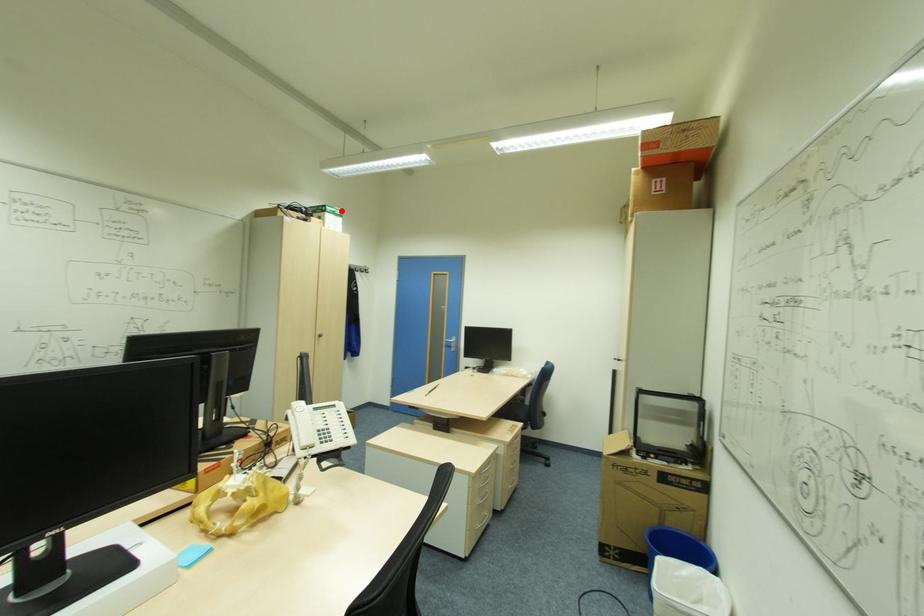
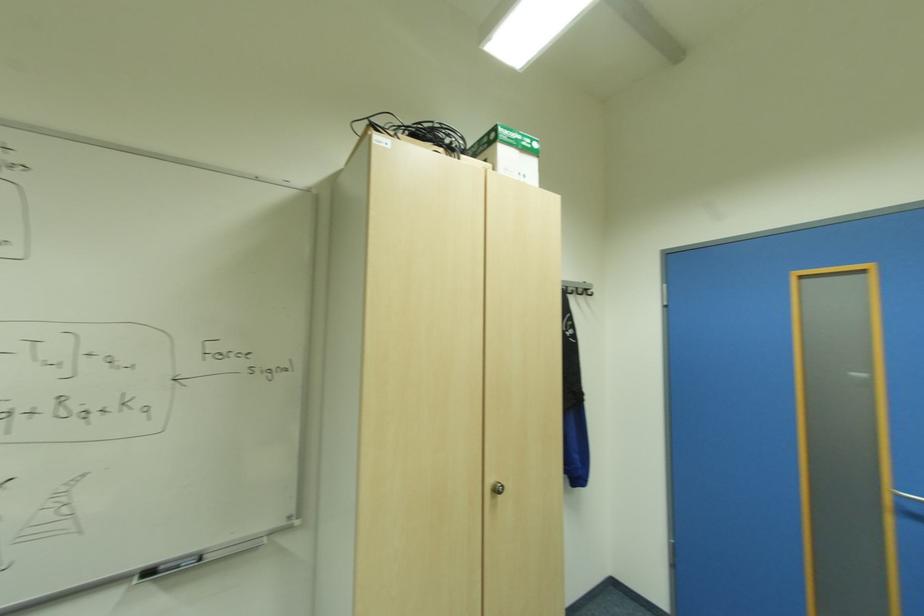
The point at the highlighted location is marked in the first image. Where is the corresponding point in the second image?

(533, 140)